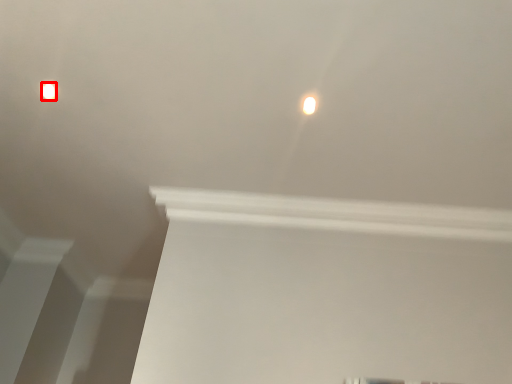
Question: From the image's perspective, what is the correct spatial positioning of lamp (annotated by the red box) in reference to lamp?

Choices:
 (A) below
 (B) above

Answer: (B)